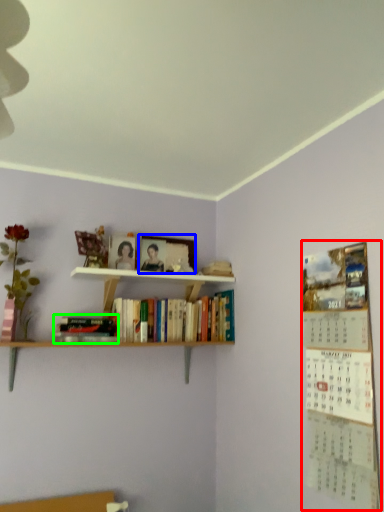
Question: Considering the real-world distances, which object is farthest from bulletin board (highlighted by a red box)? picture frame (highlighted by a blue box) or book (highlighted by a green box)?

Choices:
 (A) picture frame
 (B) book

Answer: (A)